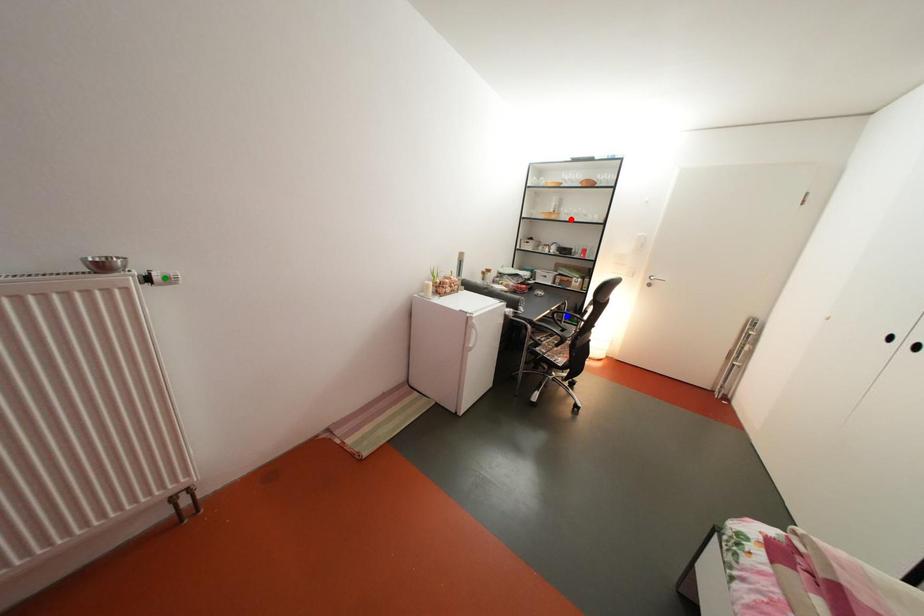
Order these from nearest to farthest:
- red point
- blue point
- green point

green point
blue point
red point